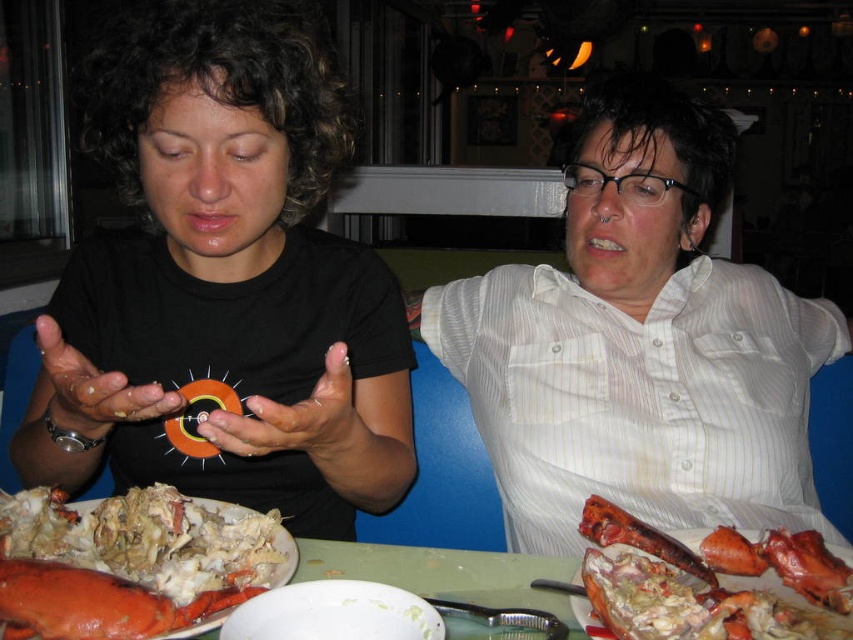
Question: Which object is farther from the camera taking this photo?

Choices:
 (A) green plastic table at center
 (B) orange rubber ring at center
 (C) shiny lobster at lower right

Answer: (B)

Question: Where is green plastic table at center located in relation to orange rubber ring at center in the image?

Choices:
 (A) right
 (B) left

Answer: (A)

Question: Is shiny red lobster at lower left smaller than orange rubber ring at center?

Choices:
 (A) no
 (B) yes

Answer: (B)

Question: Which point is closer to the camera?

Choices:
 (A) click(x=334, y=355)
 (B) click(x=88, y=412)

Answer: (A)

Question: Does shiny lobster claw at lower left appear on the left side of green plastic table at center?

Choices:
 (A) no
 (B) yes

Answer: (B)

Question: Which point appears farthest from the camera in this image?

Choices:
 (A) (187, 180)
 (B) (39, 595)
 (C) (51, 353)

Answer: (A)